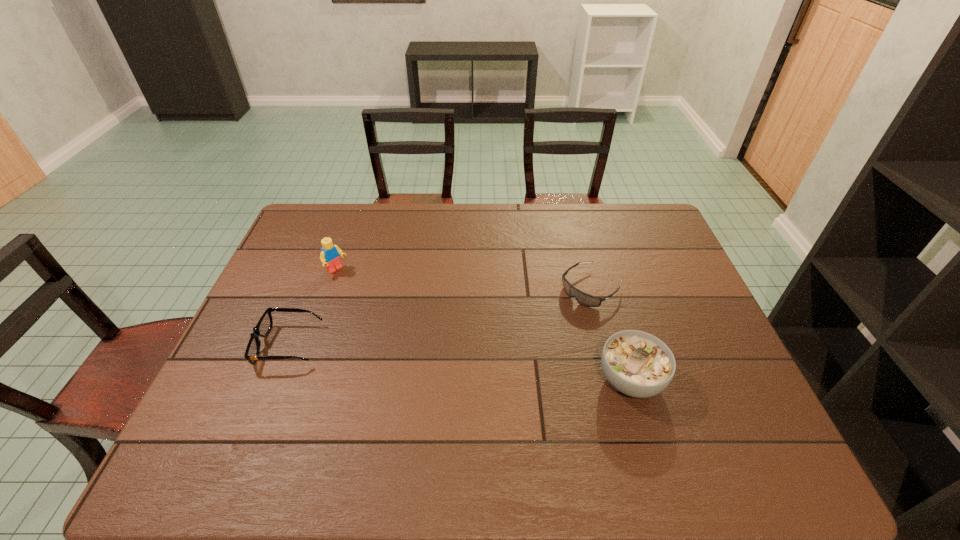
Locate which object is the third closest to the sunglasses. Please provide its 2D coordinates. Your answer should be formatted as a tuple, i.e. [(x, y)], where the tuple contains the x and y coordinates of a point satisfying the conditions above.

[(638, 364)]

Select which object is the third closest to the third shortest object. Please provide its 2D coordinates. Your answer should be formatted as a tuple, i.e. [(x, y)], where the tuple contains the x and y coordinates of a point satisfying the conditions above.

[(330, 254)]

Image resolution: width=960 pixels, height=540 pixels. What are the coordinates of `vacant space that satisfies the following two spatial constraints: 1. on the front side of the Lego; 2. on the left side of the goggles` in the screenshot? It's located at (330, 288).